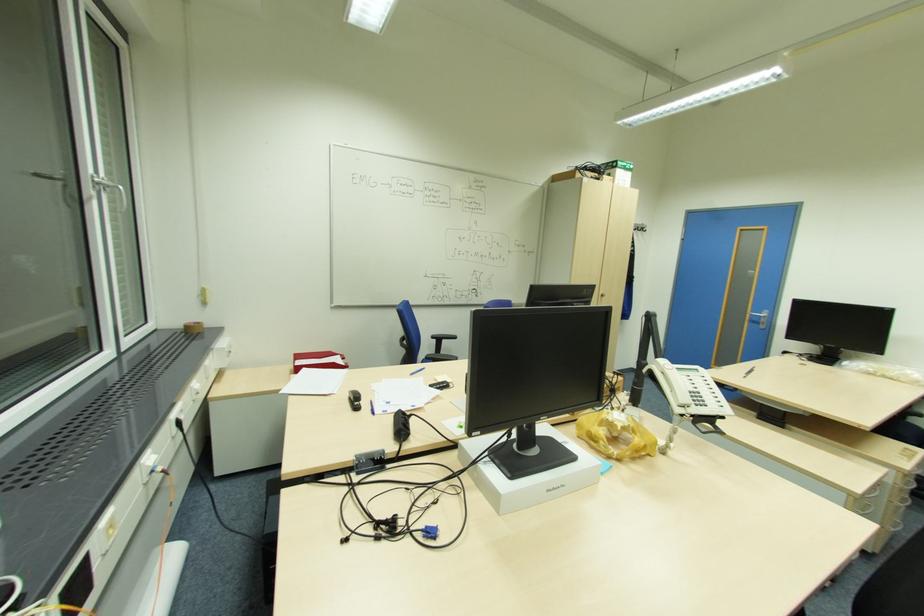
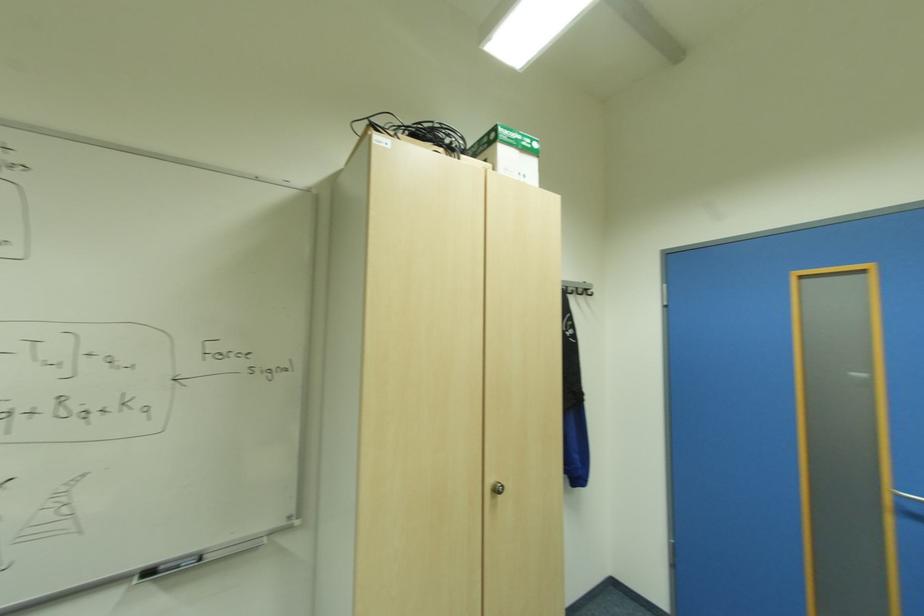
Where in the second image is the point corresponding to point 646,228 from the first image?

(588, 291)